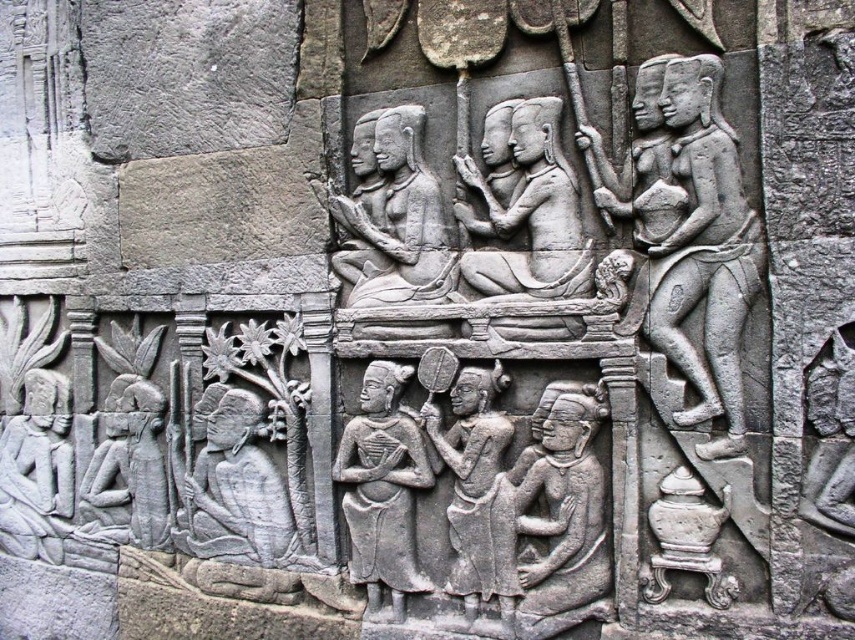
You are an archaeologist examining the ancient stone relief. You notice the gray stone figure at right and the gray stone figure at center. Which of these two figures is wider?

The gray stone figure at center is wider than the gray stone figure at right.

You are an archaeologist examining the ancient stone relief. You notice two gray stone figures at center and a gray stone figure at lower left. Which one is positioned closer to your viewpoint?

The gray stone figures at center are closer to the viewer than the gray stone figure at lower left.

Based on the spatial arrangement in the ancient stone relief, which object is positioned closer to the viewer between the gray stone figure at right and the gray stone statue at center?

The gray stone figure at right is positioned closer to the viewer as it is in front of the gray stone statue at center.